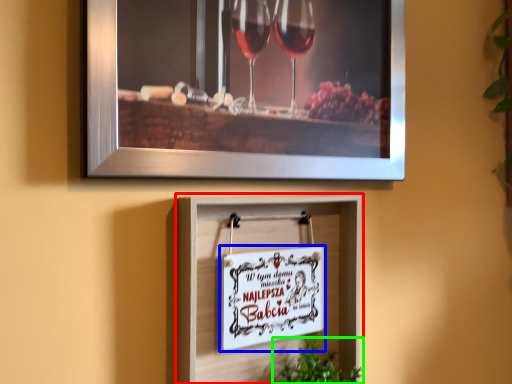
Question: Which object is the closest to the picture frame (highlighted by a red box)? Choose among these: picture frame (highlighted by a blue box) or plant (highlighted by a green box).

Choices:
 (A) picture frame
 (B) plant

Answer: (A)